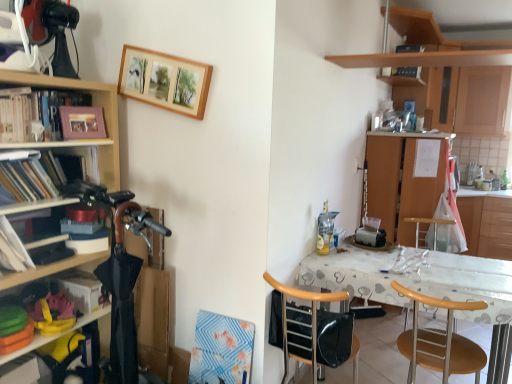
I want to click on free space above wooden picture frame at upper center, the 2th picture frame positioned from the left (from a real-world perspective), so click(x=159, y=48).